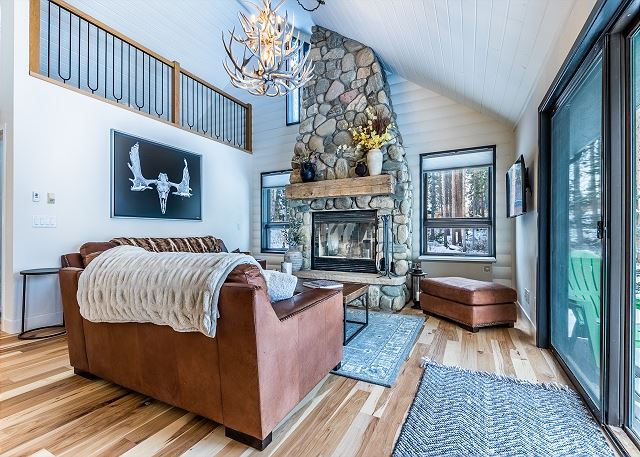
The width and height of the screenshot is (640, 457). What are the coordinates of `hardwoord floor` in the screenshot? It's located at (45, 358), (16, 438), (107, 438), (331, 441), (348, 401), (447, 345), (507, 355).